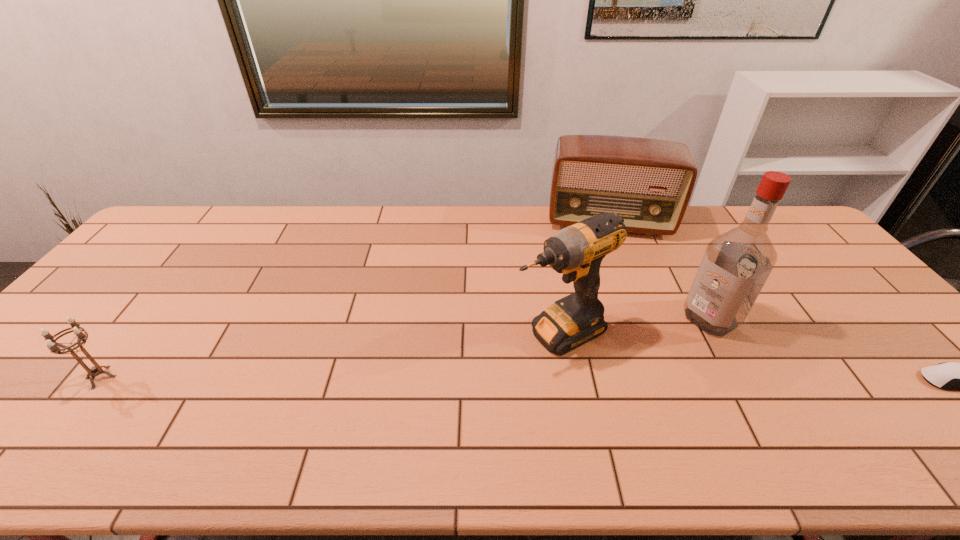
This screenshot has width=960, height=540. Identify the location of vacant space that is in between the second shortest object and the tallest object. (406, 348).

Where is `vacant space in between the second tallest object and the tallest object`? vacant space in between the second tallest object and the tallest object is located at coordinates (635, 325).

Image resolution: width=960 pixels, height=540 pixels. Find the location of `vacant point located between the fourth shortest object and the second shortest object`. vacant point located between the fourth shortest object and the second shortest object is located at coordinates (329, 354).

Locate an element on the screen. The height and width of the screenshot is (540, 960). object that is the fourth closest one to the drill is located at coordinates point(54,347).

Where is `object that is the closest one to the shortest object`? The image size is (960, 540). object that is the closest one to the shortest object is located at coordinates (736, 264).